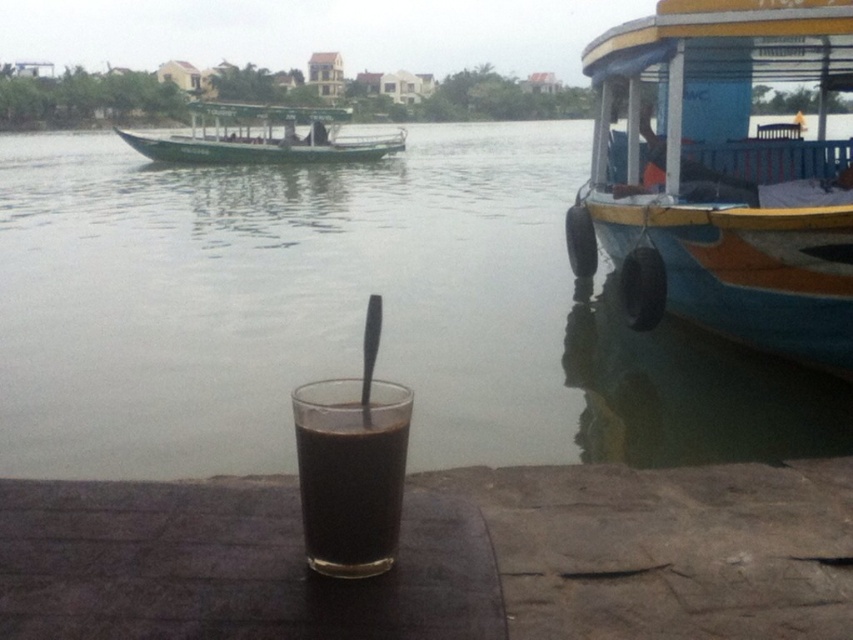
Based on the photo, is black glass at center thinner than green matte boat at upper left?

Yes.

Based on the photo, can you confirm if black glass at center is shorter than green matte boat at upper left?

Correct, black glass at center is not as tall as green matte boat at upper left.

At what (x,y) coordinates should I click in order to perform the action: click on black glass at center. Please return your answer as a coordinate pair (x, y). This screenshot has width=853, height=640. Looking at the image, I should click on (350, 472).

From the picture: Which is more to the right, transparent glass at center or blue painted wood boat at right?

blue painted wood boat at right

Between transparent glass at center and blue painted wood boat at right, which one has more height?

transparent glass at center

Where is `transparent glass at center`? transparent glass at center is located at coordinates (349, 316).

Between blue painted wood boat at right and green matte boat at upper left, which one appears on the right side from the viewer's perspective?

blue painted wood boat at right

You are a GUI agent. You are given a task and a screenshot of the screen. Output one action in this format:
    pyautogui.click(x=<x>, y=<y>)
    Task: Click on the blue painted wood boat at right
    The width and height of the screenshot is (853, 640).
    Given the screenshot: What is the action you would take?
    pyautogui.click(x=723, y=176)